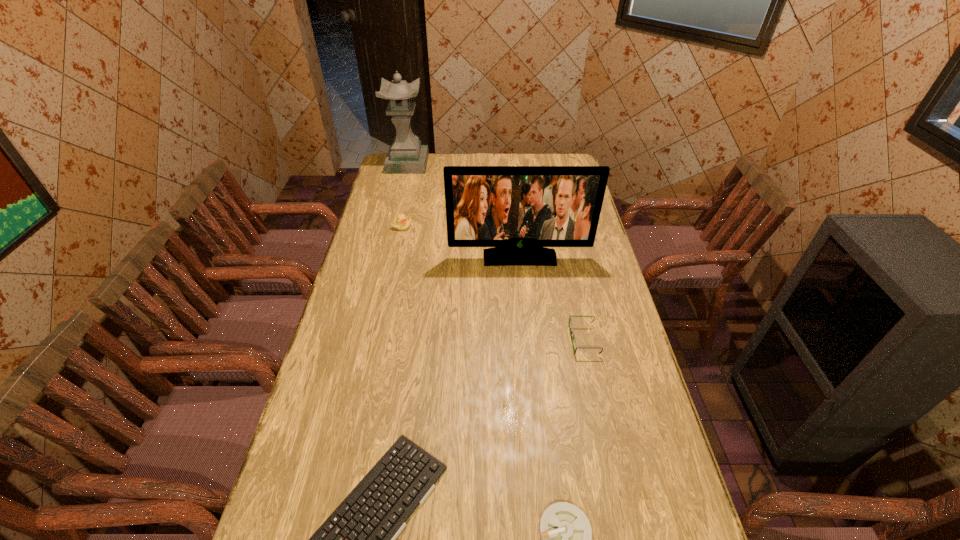
At what (x,y) coordinates should I click in order to perform the action: click on free location located 0.320m on the lens of the spectacles. Please return your answer as a coordinate pair (x, y). Looking at the image, I should click on (468, 340).

I want to click on blank space located 0.160m on the lens of the spectacles, so click(x=519, y=340).

The image size is (960, 540). I want to click on vacant space located on the lens of the spectacles, so click(491, 340).

Where is `object present at the far edge`? This screenshot has width=960, height=540. object present at the far edge is located at coordinates (406, 155).

This screenshot has height=540, width=960. I want to click on sculpture present at the left edge, so click(406, 155).

Locate an element on the screen. duckling at the left edge is located at coordinates (x=401, y=222).

Find the location of a particular element. This screenshot has height=540, width=960. monitor that is at the right edge is located at coordinates (518, 210).

This screenshot has height=540, width=960. Identify the location of spectacles situated at the right edge. (570, 319).

Locate an element on the screen. This screenshot has width=960, height=540. object present at the far left corner is located at coordinates (406, 155).

This screenshot has width=960, height=540. In order to click on vacant space at the far edge of the desktop in this screenshot , I will do `click(422, 177)`.